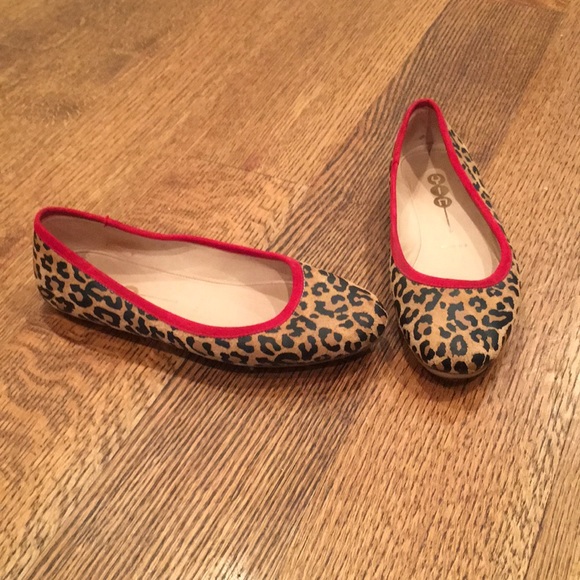
You are a GUI agent. You are given a task and a screenshot of the screen. Output one action in this format:
    pyautogui.click(x=<x>, y=<y>)
    Task: Click on the wooden floor
    The height and width of the screenshot is (580, 580).
    Given the screenshot: What is the action you would take?
    pyautogui.click(x=321, y=491)